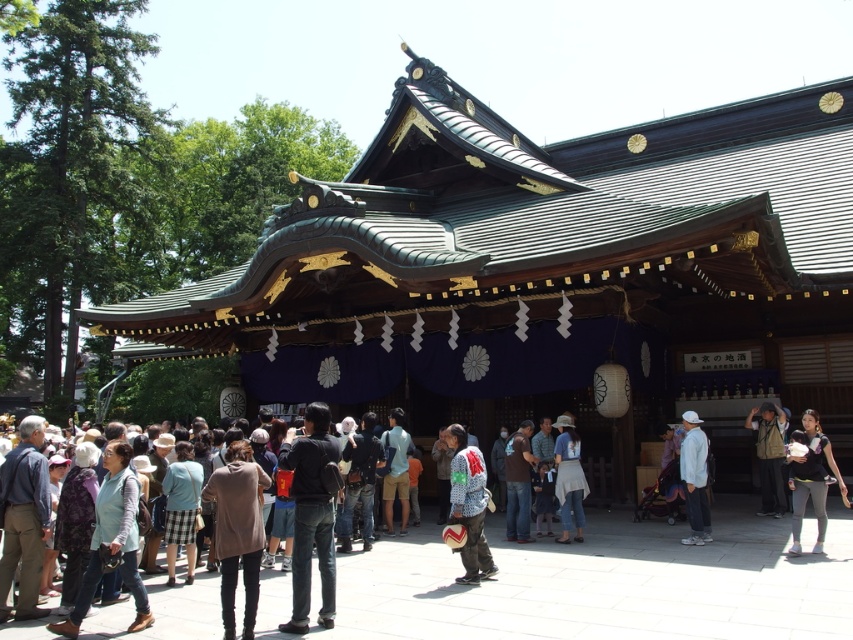
Which is below, black fabric baby carrier at lower right or light blue fabric backpack at center?

light blue fabric backpack at center is lower down.

Is black fabric baby carrier at lower right behind light blue fabric backpack at center?

No, black fabric baby carrier at lower right is closer to the viewer.

Is point (813, 486) closer to camera compared to point (399, 464)?

Yes, it is.

Find the location of a particular element. The height and width of the screenshot is (640, 853). black fabric baby carrier at lower right is located at coordinates click(x=811, y=477).

Who is positioned more to the left, plaid fabric skirt at center or light blue fabric backpack at center?

plaid fabric skirt at center

Is point (169, 502) positioned in front of point (405, 461)?

Yes, it is.

You are a GUI agent. You are given a task and a screenshot of the screen. Output one action in this format:
    pyautogui.click(x=<x>, y=<y>)
    Task: Click on the plaid fabric skirt at center
    This screenshot has height=640, width=853.
    Given the screenshot: What is the action you would take?
    (x=181, y=508)

Is point (173, 492) positioned before point (527, 483)?

That is True.

Between plaid fabric skirt at center and denim jeans at center, which one is positioned lower?

plaid fabric skirt at center is below.

You are a GUI agent. You are given a task and a screenshot of the screen. Output one action in this format:
    pyautogui.click(x=<x>, y=<y>)
    Task: Click on the plaid fabric skirt at center
    
    Given the screenshot: What is the action you would take?
    pyautogui.click(x=181, y=508)